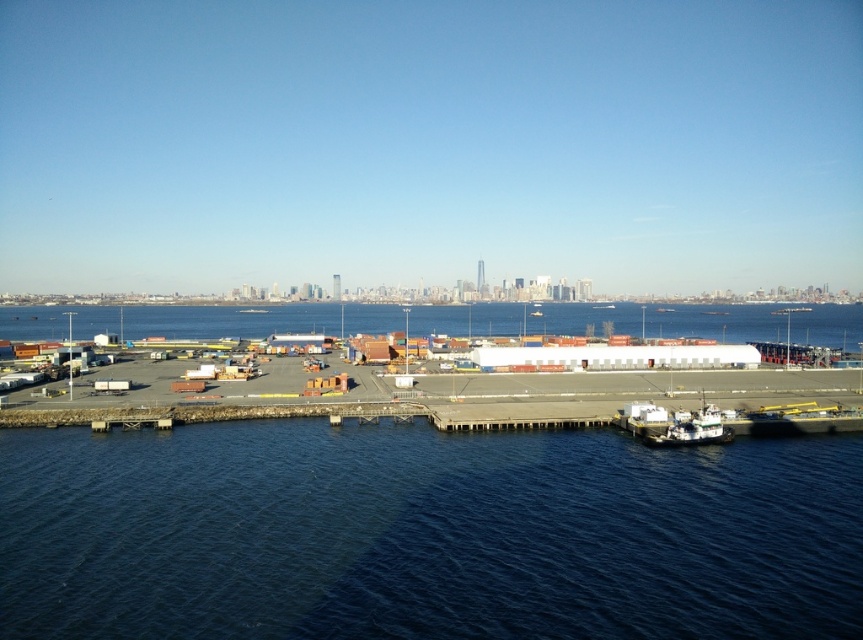
What are the coordinates of the dark blue water at lower center in the image?

The coordinates of the dark blue water at lower center are at point (424,536).

You are standing on the dock and want to get to the white matte boat at lower right. Which direction should you walk to move away from the dark blue water at lower center?

To move away from the dark blue water at lower center, you should walk towards the city skyline in the background. Since the dark blue water at lower center is closer to the viewer, moving away from it would mean heading towards the background where the white matte boat at lower right is located.